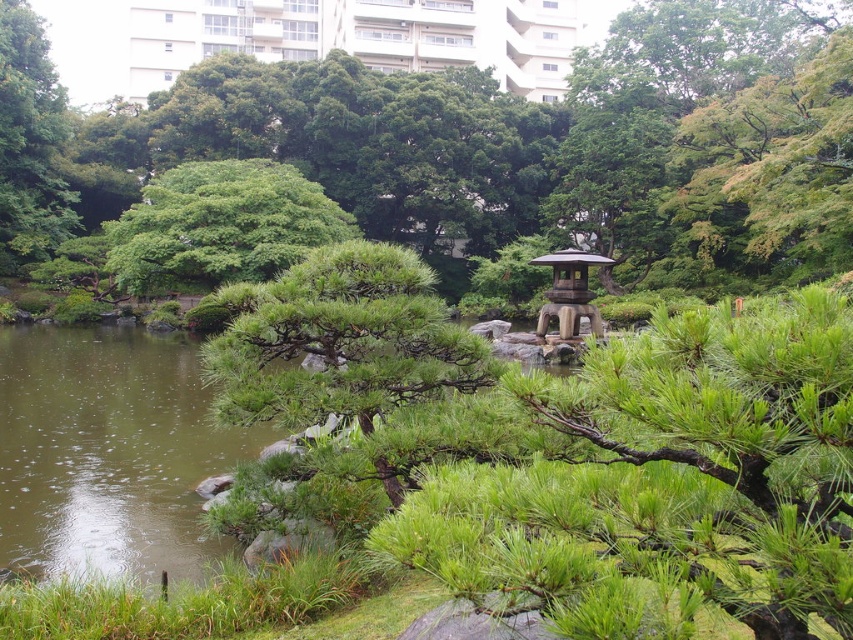
Does green matte tree at center have a greater width compared to wooden lantern at center?

Yes, green matte tree at center is wider than wooden lantern at center.

Which is in front, point (468, 232) or point (576, 268)?

Point (576, 268)

The image size is (853, 640). Identify the location of green matte tree at center. (491, 145).

Based on the photo, is green leafy tree at center thinner than wooden lantern at center?

In fact, green leafy tree at center might be wider than wooden lantern at center.

The image size is (853, 640). Describe the element at coordinates (219, 227) in the screenshot. I see `green leafy tree at center` at that location.

I want to click on green leafy tree at center, so click(219, 227).

Can you confirm if green matte tree at center is taller than green leafy tree at center?

Correct, green matte tree at center is much taller as green leafy tree at center.

Is green matte tree at center below green leafy tree at center?

No, green matte tree at center is not below green leafy tree at center.

Where is `green matte tree at center`? green matte tree at center is located at coordinates (491, 145).